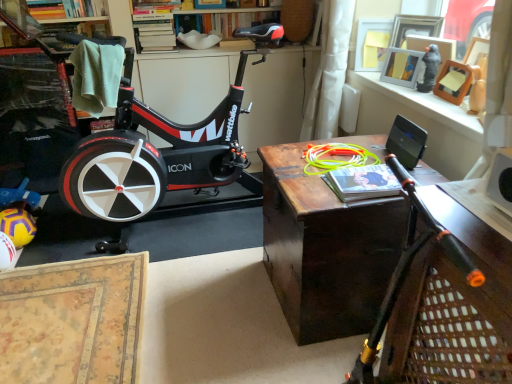
Question: Can you confirm if hardcover book at upper left, acting as the 2th book starting from the bottom, is positioned to the left of wooden bookshelf at upper center?

Choices:
 (A) no
 (B) yes

Answer: (B)

Question: Is hardcover book at upper left, which is counted as the 1th book, starting from the left, positioned with its back to wooden bookshelf at upper center?

Choices:
 (A) no
 (B) yes

Answer: (A)

Question: Does hardcover book at upper left, positioned as the 1th book in back-to-front order, turn towards wooden bookshelf at upper center?

Choices:
 (A) yes
 (B) no

Answer: (B)

Question: Is hardcover book at upper left, which is the second book in right-to-left order, outside wooden bookshelf at upper center?

Choices:
 (A) yes
 (B) no

Answer: (A)

Question: Considering the relative sizes of hardcover book at upper left, acting as the second book starting from the front, and wooden bookshelf at upper center in the image provided, is hardcover book at upper left, acting as the second book starting from the front, shorter than wooden bookshelf at upper center?

Choices:
 (A) yes
 (B) no

Answer: (A)

Question: Is hardcover book at upper left, acting as the second book starting from the front, directly adjacent to wooden bookshelf at upper center?

Choices:
 (A) no
 (B) yes

Answer: (A)

Question: Is wooden bookshelf at upper center positioned in front of dark wood table at center?

Choices:
 (A) no
 (B) yes

Answer: (A)

Question: Is wooden bookshelf at upper center touching dark wood table at center?

Choices:
 (A) no
 (B) yes

Answer: (A)

Question: Does wooden bookshelf at upper center appear on the right side of dark wood table at center?

Choices:
 (A) no
 (B) yes

Answer: (A)

Question: From a real-world perspective, is wooden bookshelf at upper center over dark wood table at center?

Choices:
 (A) yes
 (B) no

Answer: (A)

Question: Can you confirm if wooden bookshelf at upper center is wider than dark wood table at center?

Choices:
 (A) yes
 (B) no

Answer: (B)

Question: Is wooden bookshelf at upper center thinner than dark wood table at center?

Choices:
 (A) yes
 (B) no

Answer: (A)

Question: Is black plastic speaker at upper right further to the viewer compared to black matte stationary bicycle at center?

Choices:
 (A) yes
 (B) no

Answer: (B)